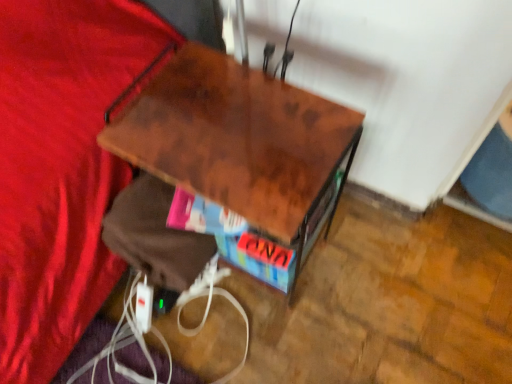
What do you see at coordinates (236, 137) in the screenshot?
I see `wooden desk at center` at bounding box center [236, 137].

Where is `wooden desk at center`? wooden desk at center is located at coordinates (236, 137).

I want to click on wooden desk at center, so click(236, 137).